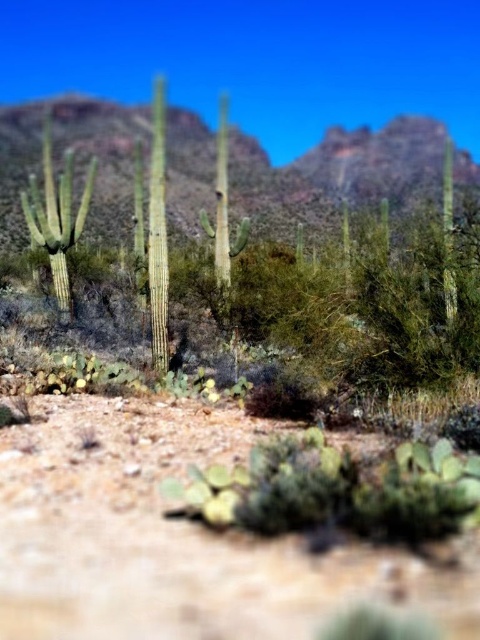
Is brown sandy dirt track at lower center bigger than green textured cactus at center?

No.

Looking at this image, does brown sandy dirt track at lower center have a greater width compared to green textured cactus at center?

No, brown sandy dirt track at lower center is not wider than green textured cactus at center.

Image resolution: width=480 pixels, height=640 pixels. What do you see at coordinates (180, 538) in the screenshot? I see `brown sandy dirt track at lower center` at bounding box center [180, 538].

Where is `brown sandy dirt track at lower center`? The width and height of the screenshot is (480, 640). brown sandy dirt track at lower center is located at coordinates (180, 538).

Is green textured cactus at center further to camera compared to green spiny cactus at left?

Yes.

How far apart are green textured cactus at center and green spiny cactus at left?

green textured cactus at center and green spiny cactus at left are 35.15 meters apart.

The height and width of the screenshot is (640, 480). I want to click on green textured cactus at center, so click(x=336, y=176).

Who is positioned more to the left, brown sandy dirt track at lower center or green spiny cactus at left?

green spiny cactus at left

Does brown sandy dirt track at lower center have a greater height compared to green spiny cactus at left?

No, brown sandy dirt track at lower center is not taller than green spiny cactus at left.

Measure the distance between brown sandy dirt track at lower center and camera.

The distance of brown sandy dirt track at lower center from camera is 5.41 meters.

In order to click on brown sandy dirt track at lower center in this screenshot , I will do `click(180, 538)`.